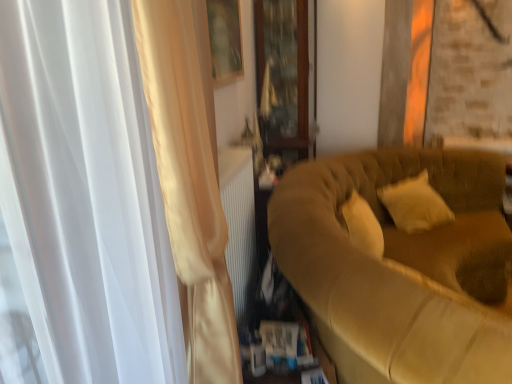
The height and width of the screenshot is (384, 512). Describe the element at coordinates (114, 192) in the screenshot. I see `satin white curtain at left` at that location.

Locate an element on the screen. The height and width of the screenshot is (384, 512). suede-like beige couch at right is located at coordinates (402, 267).

The width and height of the screenshot is (512, 384). I want to click on satin white curtain at left, so click(x=114, y=192).

Identify the location of curtain below the transparent wooden cabinet at center (from the image's perspective). (114, 192).

Is satin white curtain at left facing towards transparent wooden cabinet at center?

No, satin white curtain at left is not turned towards transparent wooden cabinet at center.

Does satin white curtain at left appear on the right side of transparent wooden cabinet at center?

In fact, satin white curtain at left is to the left of transparent wooden cabinet at center.

Where is `glass door that appears behind the soft white pillow at right`? This screenshot has height=384, width=512. glass door that appears behind the soft white pillow at right is located at coordinates (283, 76).

Considering the sizes of objects transparent wooden cabinet at center and soft white pillow at right in the image provided, who is shorter, transparent wooden cabinet at center or soft white pillow at right?

With less height is soft white pillow at right.

Is transparent wooden cabinet at center oriented towards soft white pillow at right?

Yes, transparent wooden cabinet at center is oriented towards soft white pillow at right.

In the scene shown: Is transparent wooden cabinet at center placed right next to soft white pillow at right?

transparent wooden cabinet at center and soft white pillow at right are not in contact.

From a real-world perspective, which is physically above, soft white pillow at right or satin white curtain at left?

From a 3D spatial view, satin white curtain at left is above.

Does point (426, 213) lie in front of point (59, 263)?

No, it is not.

Is soft white pillow at right looking in the opposite direction of satin white curtain at left?

soft white pillow at right is not turned away from satin white curtain at left.

Is satin white curtain at left not within soft white pillow at right?

Absolutely, satin white curtain at left is external to soft white pillow at right.

Considering their positions, is satin white curtain at left located in front of or behind soft white pillow at right?

satin white curtain at left is positioned closer to the viewer than soft white pillow at right.

From the image's perspective, which one is positioned higher, satin white curtain at left or soft white pillow at right?

soft white pillow at right, from the image's perspective.

Between suede-like beige couch at right and satin white curtain at left, which one has smaller width?

satin white curtain at left.

Considering the relative positions of suede-like beige couch at right and satin white curtain at left in the image provided, is suede-like beige couch at right in front of satin white curtain at left?

That is True.

Which is behind, point (450, 223) or point (169, 360)?

The point (450, 223) is behind.

Is suede-like beige couch at right touching satin white curtain at left?

suede-like beige couch at right and satin white curtain at left are not in contact.

You are a GUI agent. You are given a task and a screenshot of the screen. Output one action in this format:
    pyautogui.click(x=<x>, y=<y>)
    Task: Click on the pillow directly beneath the transparent wooden cabinet at center (from a real-world perspective)
    Image resolution: width=512 pixels, height=384 pixels.
    Given the screenshot: What is the action you would take?
    pyautogui.click(x=415, y=204)

From the image's perspective, which is below, soft white pillow at right or transparent wooden cabinet at center?

soft white pillow at right, from the image's perspective.

Is suede-like beige couch at right smaller than soft white pillow at right?

No, suede-like beige couch at right is not smaller than soft white pillow at right.

Are suede-like beige couch at right and soft white pillow at right far apart?

They are positioned close to each other.

From the picture: Could soft white pillow at right be considered to be inside suede-like beige couch at right?

Absolutely, soft white pillow at right is inside suede-like beige couch at right.

Where is `curtain below the transparent wooden cabinet at center (from the image's perspective)`? The width and height of the screenshot is (512, 384). curtain below the transparent wooden cabinet at center (from the image's perspective) is located at coordinates (114, 192).

The height and width of the screenshot is (384, 512). Identify the location of pillow below the transparent wooden cabinet at center (from a real-world perspective). (x=415, y=204).

When comparing their distances from suede-like beige couch at right, does transparent wooden cabinet at center or soft white pillow at right seem further?

transparent wooden cabinet at center.

Looking at the image, which one is located closer to suede-like beige couch at right, soft white pillow at right or satin white curtain at left?

Among the two, soft white pillow at right is located nearer to suede-like beige couch at right.

Consider the image. Considering their positions, is soft white pillow at right positioned further to satin white curtain at left than transparent wooden cabinet at center?

Among the two, transparent wooden cabinet at center is located further to satin white curtain at left.

Looking at the image, which one is located further to suede-like beige couch at right, transparent wooden cabinet at center or satin white curtain at left?

transparent wooden cabinet at center is positioned further to the anchor suede-like beige couch at right.

Which object lies nearer to the anchor point suede-like beige couch at right, satin white curtain at left or transparent wooden cabinet at center?

satin white curtain at left is closer to suede-like beige couch at right.

From the image, which object appears to be nearer to soft white pillow at right, transparent wooden cabinet at center or suede-like beige couch at right?

suede-like beige couch at right.

From the image, which object appears to be farther from soft white pillow at right, satin white curtain at left or suede-like beige couch at right?

satin white curtain at left is positioned further to the anchor soft white pillow at right.

From the image, which object appears to be farther from satin white curtain at left, soft white pillow at right or suede-like beige couch at right?

soft white pillow at right lies further to satin white curtain at left than the other object.

At what (x,y) coordinates should I click in order to perform the action: click on pillow between satin white curtain at left and transparent wooden cabinet at center from front to back. Please return your answer as a coordinate pair (x, y). The width and height of the screenshot is (512, 384). Looking at the image, I should click on (415, 204).

This screenshot has width=512, height=384. Identify the location of curtain located between suede-like beige couch at right and soft white pillow at right in the depth direction. coord(114,192).

Find the location of a particular element. This screenshot has height=384, width=512. curtain between suede-like beige couch at right and transparent wooden cabinet at center in the front-back direction is located at coordinates (114, 192).

This screenshot has height=384, width=512. In order to click on pillow between suede-like beige couch at right and transparent wooden cabinet at center along the z-axis in this screenshot , I will do (x=415, y=204).